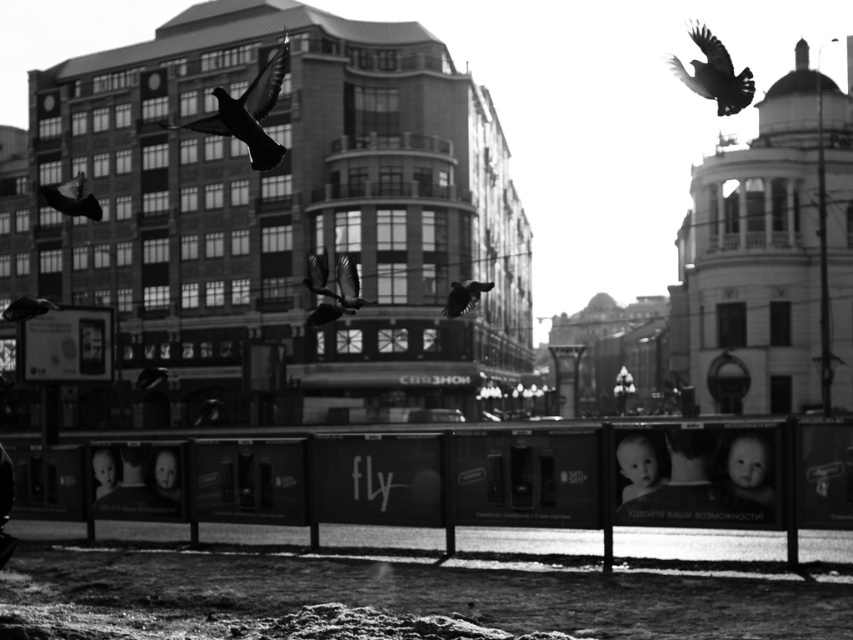
Consider the image. Can you confirm if shiny black bird at center is wider than silvery metallic bird at center?

No, shiny black bird at center is not wider than silvery metallic bird at center.

Between shiny black bird at center and silvery metallic bird at center, which one is positioned lower?

Positioned lower is silvery metallic bird at center.

Does point (456, 288) come in front of point (138, 385)?

Yes, it is in front of point (138, 385).

Identify the location of shiny black bird at center. (463, 296).

Does black matte bird at upper right appear on the left side of shiny black bird at lower left?

Incorrect, black matte bird at upper right is not on the left side of shiny black bird at lower left.

Is black matte bird at upper right closer to camera compared to shiny black bird at lower left?

Yes, it is in front of shiny black bird at lower left.

In order to click on black matte bird at upper right in this screenshot , I will do `click(714, 74)`.

The width and height of the screenshot is (853, 640). Describe the element at coordinates (714, 74) in the screenshot. I see `black matte bird at upper right` at that location.

Does point (732, 93) lie behind point (165, 369)?

No, (732, 93) is in front of (165, 369).

Find the location of a particular element. black matte bird at upper right is located at coordinates (714, 74).